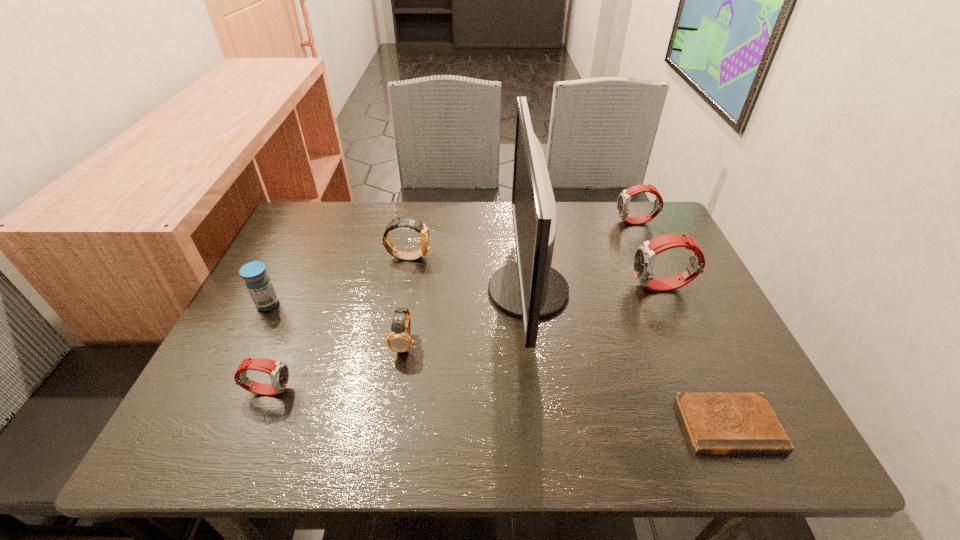
Where is `vacant area that lies between the fifth object from left to right and the bigger gold watch`? This screenshot has height=540, width=960. vacant area that lies between the fifth object from left to right and the bigger gold watch is located at coordinates (468, 274).

What are the coordinates of `free space between the fourth nearest watch and the diary` in the screenshot? It's located at (568, 341).

In order to click on vacant space that's between the nearer gold watch and the shortest object in this screenshot , I will do `click(567, 383)`.

The image size is (960, 540). Find the location of `free spot between the leftmost red watch and the smaller gold watch`. free spot between the leftmost red watch and the smaller gold watch is located at coordinates [x=337, y=366].

In order to click on free space between the smaller gold watch and the nearest watch in this screenshot , I will do `click(337, 366)`.

Locate an element on the screen. vacant space in between the nearest red watch and the second tallest object is located at coordinates (466, 339).

Identify the location of vacant space that's between the medicine and the seventh object from right to left. The width and height of the screenshot is (960, 540). (268, 347).

Choose which object is the seventh nearest neighbor to the shortest object. Please provide its 2D coordinates. Your answer should be formatted as a tuple, i.e. [(x, y)], where the tuple contains the x and y coordinates of a point satisfying the conditions above.

[(257, 281)]

Locate which object ranks fourth in proximity to the leftmost watch. Please provide its 2D coordinates. Your answer should be formatted as a tuple, i.e. [(x, y)], where the tuple contains the x and y coordinates of a point satisfying the conditions above.

[(530, 288)]

Point out which watch is positioned as the nearest to the leftmost watch. Please provide its 2D coordinates. Your answer should be formatted as a tuple, i.e. [(x, y)], where the tuple contains the x and y coordinates of a point satisfying the conditions above.

[(399, 340)]